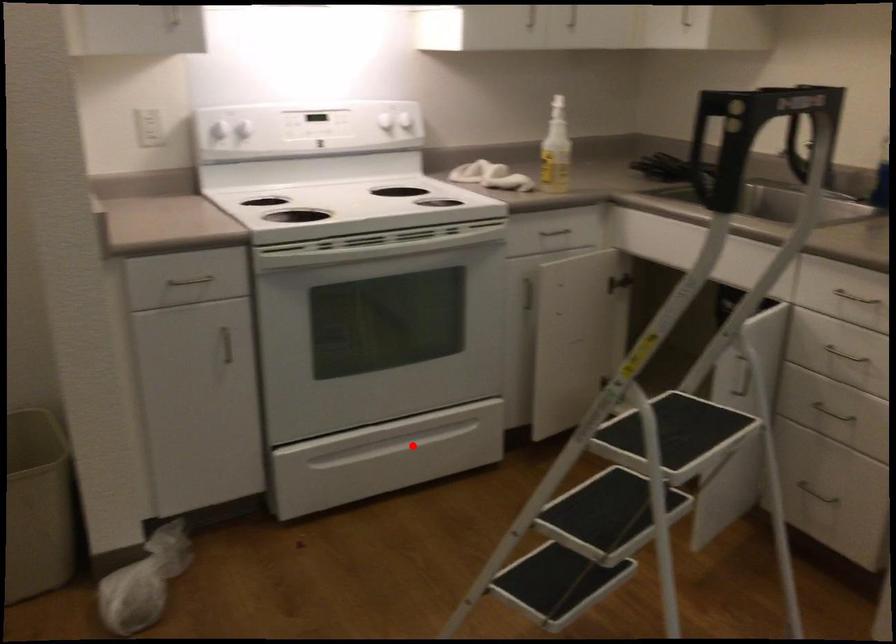
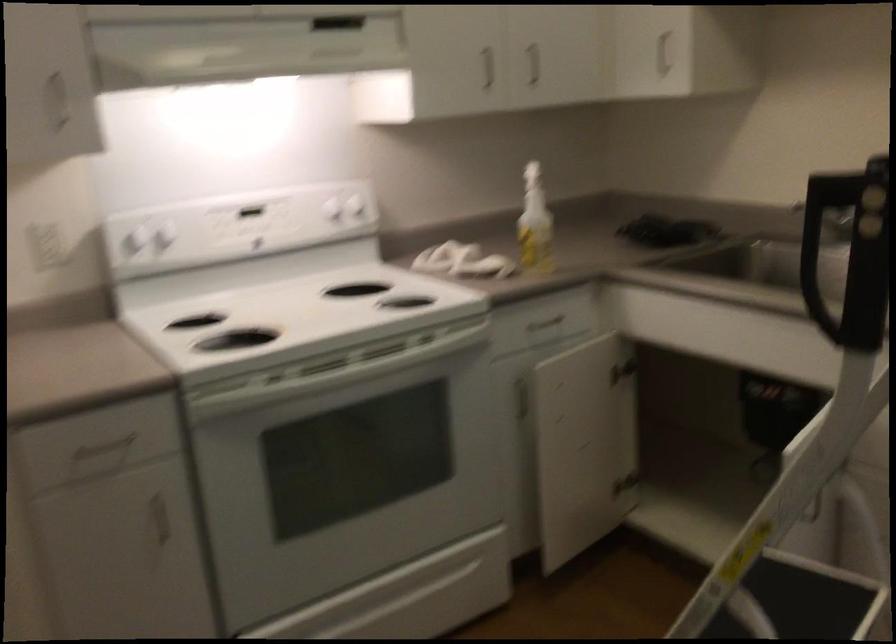
Locate, in the second image, the point that corresponds to the highlighted location in the first image.

(409, 596)